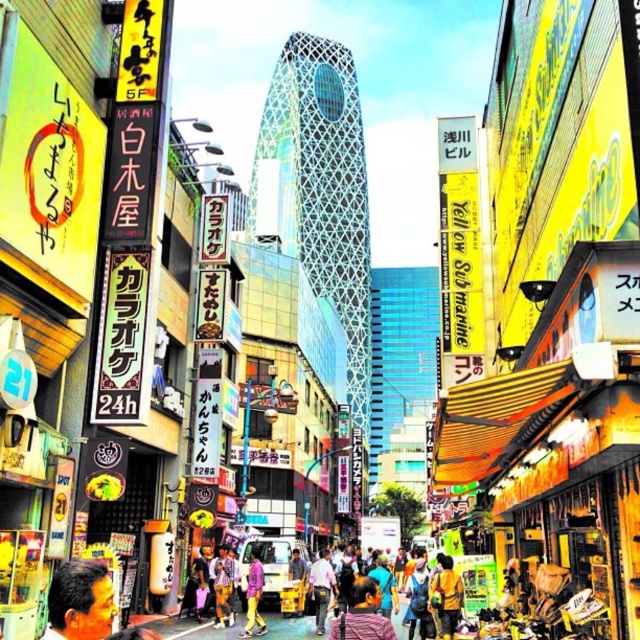
Who is lower down, orange hair at center or denim jacket at center?

orange hair at center

This screenshot has width=640, height=640. I want to click on orange hair at center, so click(x=362, y=614).

This screenshot has width=640, height=640. I want to click on orange hair at center, so click(x=362, y=614).

Is point (451, 598) more distant than point (253, 586)?

That is False.

Does denim jacket at center have a greater height compared to purple matte shirt at center?

No, denim jacket at center is not taller than purple matte shirt at center.

This screenshot has height=640, width=640. Describe the element at coordinates (445, 596) in the screenshot. I see `denim jacket at center` at that location.

The image size is (640, 640). I want to click on denim jacket at center, so (445, 596).

Looking at this image, is orange hair at center below purple matte shirt at center?

No, orange hair at center is not below purple matte shirt at center.

Between point (353, 620) and point (252, 552), which one is positioned behind?

Point (252, 552)

At what (x,y) coordinates should I click in order to perform the action: click on orange hair at center. Please return your answer as a coordinate pair (x, y). Looking at the image, I should click on (362, 614).

Find the location of a particular element. orange hair at center is located at coordinates (362, 614).